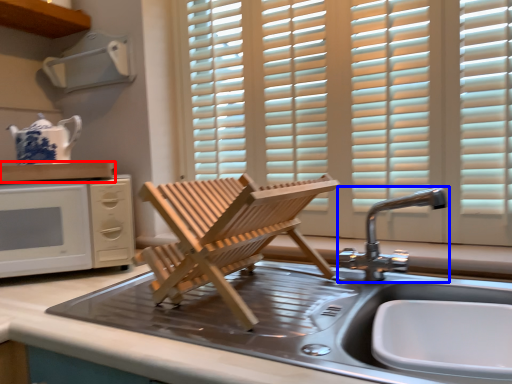
Question: Which object appears closest to the camera in this image, countertop (highlighted by a red box) or tap (highlighted by a blue box)?

Choices:
 (A) countertop
 (B) tap

Answer: (B)